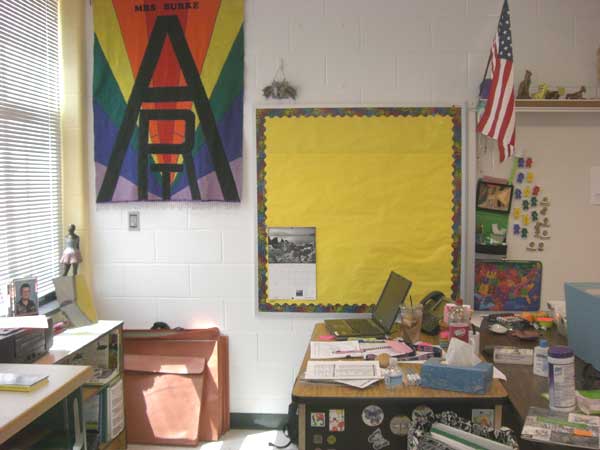
In order to click on calendar in this screenshot , I will do `click(287, 247)`.